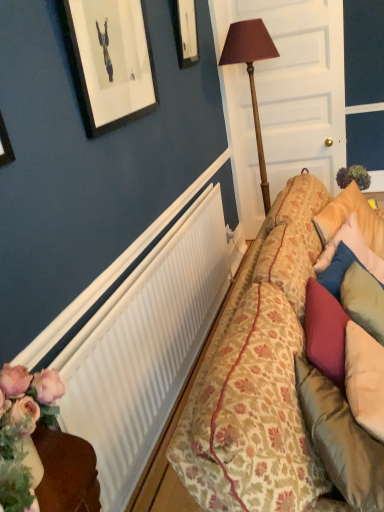
Question: Relative to wooden picture frame at upper center, is wooden table lamp at center in front or behind?

Choices:
 (A) front
 (B) behind

Answer: (B)

Question: Considering the positions of wooden table lamp at center and wooden picture frame at upper center in the image, is wooden table lamp at center wider or thinner than wooden picture frame at upper center?

Choices:
 (A) wide
 (B) thin

Answer: (A)

Question: Considering the real-world distances, which object is closest to the wooden table lamp at center?

Choices:
 (A) white ribbed radiator at center
 (B) floral-patterned fabric couch at right
 (C) white wood door at center
 (D) wooden picture frame at upper center

Answer: (D)

Question: Which object is positioned farthest from the white wood door at center?

Choices:
 (A) wooden table lamp at center
 (B) floral-patterned fabric couch at right
 (C) wooden picture frame at upper center
 (D) white ribbed radiator at center

Answer: (B)